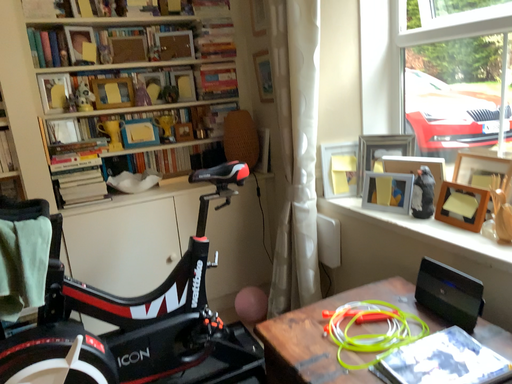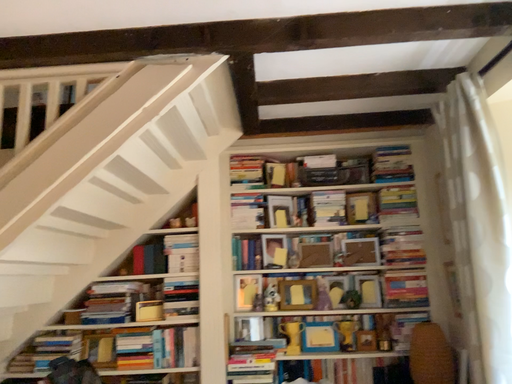
Question: How did the camera likely rotate when shooting the video?

Choices:
 (A) rotated downward
 (B) rotated upward

Answer: (B)